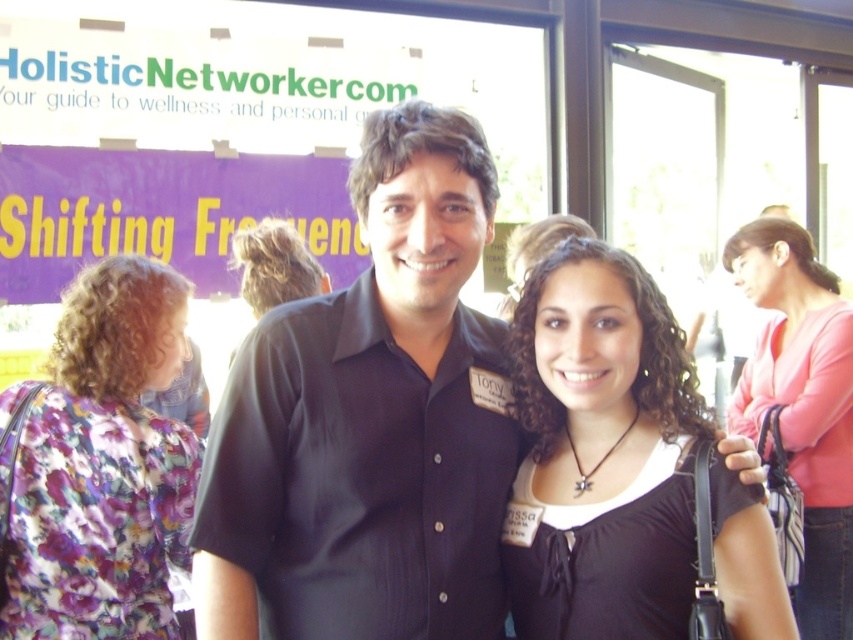
Question: Can you confirm if black matte shirt at center is wider than floral fabric dress at left?

Choices:
 (A) yes
 (B) no

Answer: (A)

Question: Estimate the real-world distances between objects in this image. Which object is closer to the black smooth shirt at center?

Choices:
 (A) floral fabric dress at left
 (B) black matte shirt at center

Answer: (B)

Question: Which of the following is the farthest from the observer?

Choices:
 (A) pink fabric shirt at upper right
 (B) black smooth shirt at center
 (C) floral fabric dress at left
 (D) black matte shirt at center

Answer: (A)

Question: Is floral fabric dress at left positioned in front of pink fabric shirt at upper right?

Choices:
 (A) yes
 (B) no

Answer: (A)

Question: Which point is closer to the camera taking this photo?

Choices:
 (A) (115, 333)
 (B) (556, 264)
 (C) (837, 312)

Answer: (B)

Question: Observing the image, what is the correct spatial positioning of black matte shirt at center in reference to floral fabric dress at left?

Choices:
 (A) above
 (B) below

Answer: (A)